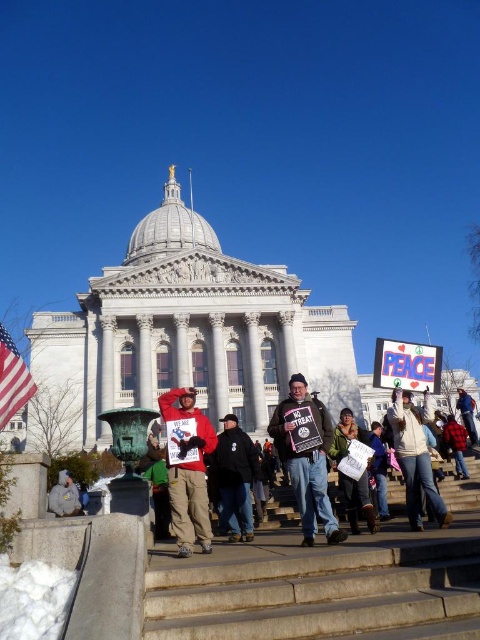
You are a photographer standing in front of the state capitol building. You want to take a photo of the black cotton jacket at center and the american flag at left. Which object is closer to you?

The black cotton jacket at center is closer to you because the american flag at left is behind it.

You are standing at the location of the gray fabric bag at lower left and want to hand a document to someone holding the white paper sign at center. Can you throw the document directly to them without it touching the ground?

The white paper sign at center is 78.06 feet away from the gray fabric bag at lower left. Throwing a document that far would be extremely difficult and likely result in it hitting the ground, so it is not advisable.